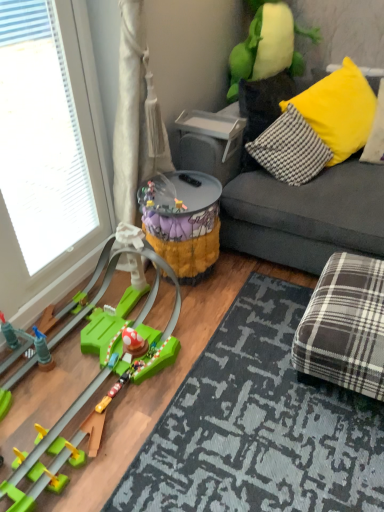
Question: Is green plastic toy at lower left, the 3th toy when ordered from top to bottom, to the left of transparent glass window at left from the viewer's perspective?

Choices:
 (A) yes
 (B) no

Answer: (B)

Question: Is transparent glass window at left surrounded by green plastic toy at lower left, the 3th toy when ordered from top to bottom?

Choices:
 (A) no
 (B) yes

Answer: (A)

Question: Is green plastic toy at lower left, acting as the first toy starting from the bottom, facing away from transparent glass window at left?

Choices:
 (A) no
 (B) yes

Answer: (A)

Question: Does green plastic toy at lower left, the 3th toy when ordered from top to bottom, come behind transparent glass window at left?

Choices:
 (A) yes
 (B) no

Answer: (B)

Question: Considering the relative sizes of green plastic toy at lower left, the 3th toy when ordered from top to bottom, and transparent glass window at left in the image provided, is green plastic toy at lower left, the 3th toy when ordered from top to bottom, taller than transparent glass window at left?

Choices:
 (A) no
 (B) yes

Answer: (A)

Question: Considering the positions of point (206, 362) and point (349, 108), is point (206, 362) closer or farther from the camera than point (349, 108)?

Choices:
 (A) closer
 (B) farther

Answer: (A)

Question: Is plaid fabric mat at lower right situated inside yellow fabric pillow at upper right, which is the 1th pillow from left to right, or outside?

Choices:
 (A) inside
 (B) outside

Answer: (B)

Question: Looking at their shapes, would you say plaid fabric mat at lower right is wider or thinner than yellow fabric pillow at upper right, the second pillow viewed from the right?

Choices:
 (A) wide
 (B) thin

Answer: (A)

Question: Visually, is plaid fabric mat at lower right positioned to the left or to the right of yellow fabric pillow at upper right, the second pillow viewed from the right?

Choices:
 (A) right
 (B) left

Answer: (B)

Question: Would you say yellow fabric pillow at upper right is to the left or to the right of plaid fabric mat at lower right in the picture?

Choices:
 (A) left
 (B) right

Answer: (B)

Question: Is yellow fabric pillow at upper right inside the boundaries of plaid fabric mat at lower right, or outside?

Choices:
 (A) outside
 (B) inside

Answer: (A)

Question: Is yellow fabric pillow at upper right wider or thinner than plaid fabric mat at lower right?

Choices:
 (A) thin
 (B) wide

Answer: (A)

Question: Is point (314, 160) positioned closer to the camera than point (302, 501)?

Choices:
 (A) closer
 (B) farther

Answer: (B)

Question: From a real-world perspective, relative to soft plush toy at upper right, acting as the 3th toy starting from the bottom, is yellow fabric pillow at upper right, the 1th pillow positioned from the right, vertically above or below?

Choices:
 (A) above
 (B) below

Answer: (B)

Question: Based on their sizes in the image, would you say yellow fabric pillow at upper right, the 1th pillow positioned from the right, is bigger or smaller than soft plush toy at upper right, acting as the 3th toy starting from the bottom?

Choices:
 (A) big
 (B) small

Answer: (B)